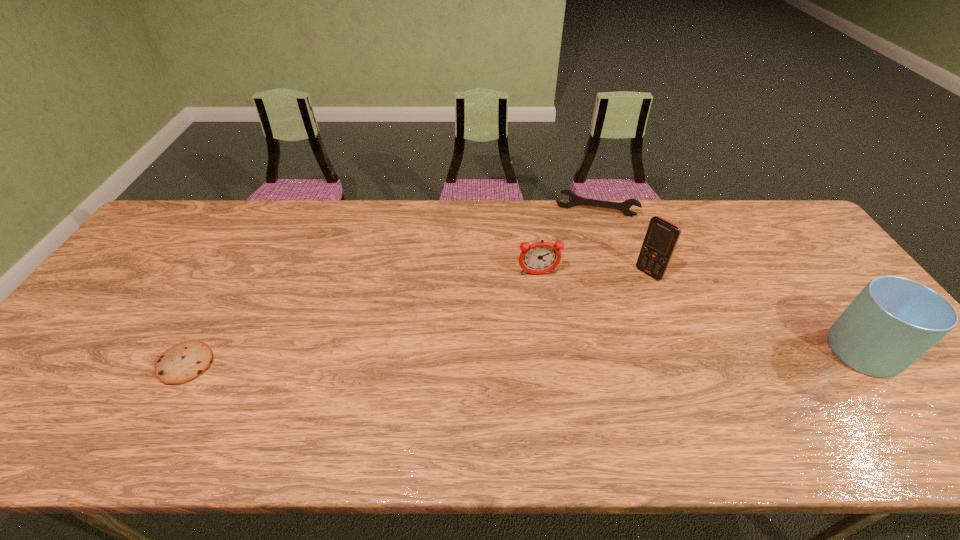
This screenshot has width=960, height=540. I want to click on cookie situated at the near edge, so click(x=184, y=362).

I want to click on mug that is at the near edge, so click(x=893, y=321).

Where is `object positioned at the right edge`? object positioned at the right edge is located at coordinates (893, 321).

The width and height of the screenshot is (960, 540). What are the coordinates of `object positioned at the near right corner` in the screenshot? It's located at (893, 321).

Locate an element on the screen. vacant area at the far edge of the desktop is located at coordinates (396, 225).

At what (x,y) coordinates should I click in order to perform the action: click on free space at the near edge. Please return your answer as a coordinate pair (x, y). This screenshot has width=960, height=540. Looking at the image, I should click on (429, 397).

Where is `free space at the left edge of the desktop`? free space at the left edge of the desktop is located at coordinates (124, 293).

Find the location of `vacant region at the right edge of the desktop`. vacant region at the right edge of the desktop is located at coordinates (770, 251).

The image size is (960, 540). Find the location of `free spot between the shortest object and the farthest object`. free spot between the shortest object and the farthest object is located at coordinates (392, 288).

Locate an element on the screen. vacant area that lies between the mug and the cookie is located at coordinates (529, 358).